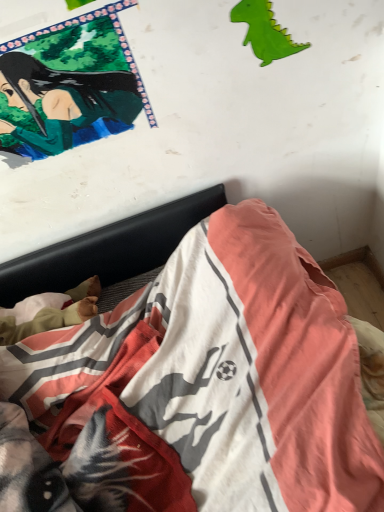
Question: Is green glossy poster at upper left wider than cotton bedspread at lower center?

Choices:
 (A) yes
 (B) no

Answer: (B)

Question: Is green glossy poster at upper left positioned with its back to cotton bedspread at lower center?

Choices:
 (A) yes
 (B) no

Answer: (B)

Question: Is green glossy poster at upper left positioned in front of cotton bedspread at lower center?

Choices:
 (A) no
 (B) yes

Answer: (A)

Question: Is green glossy poster at upper left completely or partially outside of cotton bedspread at lower center?

Choices:
 (A) yes
 (B) no

Answer: (A)

Question: Is there a large distance between green glossy poster at upper left and cotton bedspread at lower center?

Choices:
 (A) no
 (B) yes

Answer: (A)

Question: Considering the positions of point (274, 57) and point (142, 307), is point (274, 57) closer or farther from the camera than point (142, 307)?

Choices:
 (A) closer
 (B) farther

Answer: (A)

Question: Relative to cotton bedspread at lower center, is green paper dinosaur at upper right in front or behind?

Choices:
 (A) front
 (B) behind

Answer: (B)

Question: Would you say green paper dinosaur at upper right is to the left or to the right of cotton bedspread at lower center in the picture?

Choices:
 (A) right
 (B) left

Answer: (A)

Question: Is green paper dinosaur at upper right taller or shorter than cotton bedspread at lower center?

Choices:
 (A) tall
 (B) short

Answer: (B)

Question: From a real-world perspective, is cotton bedspread at lower center physically located above or below green paper dinosaur at upper right?

Choices:
 (A) below
 (B) above

Answer: (A)

Question: Is cotton bedspread at lower center wider or thinner than green paper dinosaur at upper right?

Choices:
 (A) wide
 (B) thin

Answer: (A)

Question: Based on their sizes in the image, would you say cotton bedspread at lower center is bigger or smaller than green paper dinosaur at upper right?

Choices:
 (A) small
 (B) big

Answer: (B)

Question: Is point (304, 281) closer or farther from the camera than point (246, 16)?

Choices:
 (A) closer
 (B) farther

Answer: (B)

Question: From the image's perspective, is green glossy poster at upper left located above or below green paper dinosaur at upper right?

Choices:
 (A) above
 (B) below

Answer: (B)

Question: In terms of width, does green glossy poster at upper left look wider or thinner when compared to green paper dinosaur at upper right?

Choices:
 (A) wide
 (B) thin

Answer: (A)